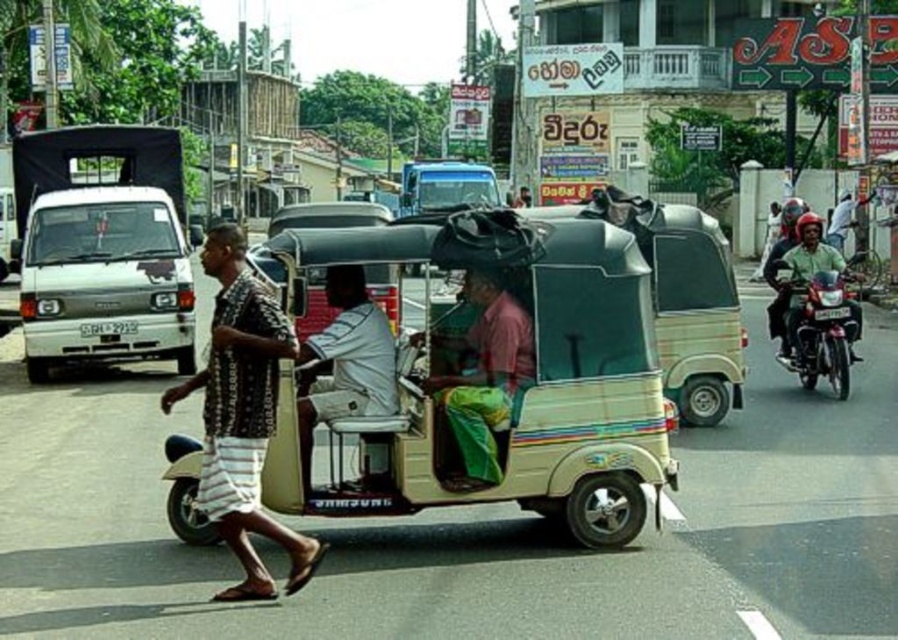
Question: Can you confirm if white matte van at left is wider than shiny metallic motorcycle at right?

Choices:
 (A) no
 (B) yes

Answer: (B)

Question: Which point is farther from the camera taking this photo?

Choices:
 (A) (826, 305)
 (B) (470, 388)

Answer: (A)

Question: Where is beige plastic tricycle at center located in relation to white matte van at left in the image?

Choices:
 (A) right
 (B) left

Answer: (A)

Question: Considering the real-world distances, which object is closest to the white matte van at left?

Choices:
 (A) shiny metallic motorcycle at right
 (B) brown printed shirt at center
 (C) pink fabric shirt at center
 (D) beige plastic tricycle at center

Answer: (D)

Question: Is beige plastic tricycle at center thinner than white matte van at left?

Choices:
 (A) no
 (B) yes

Answer: (A)

Question: Which of the following is the farthest from the observer?

Choices:
 (A) beige plastic tricycle at center
 (B) shiny metallic motorcycle at right
 (C) brown printed shirt at center

Answer: (B)